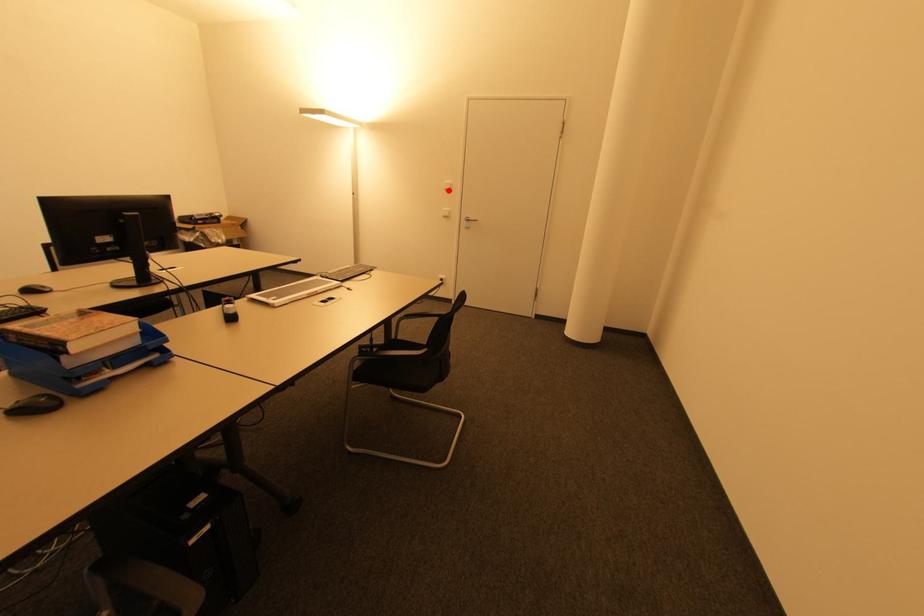
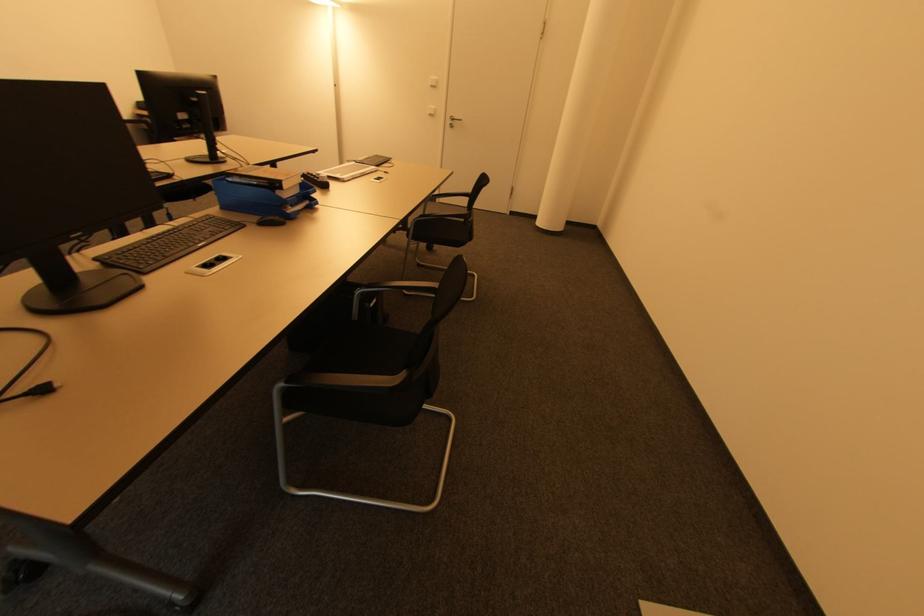
Locate, in the second image, the point that corresponds to the highlighted location in the first image.

(434, 87)